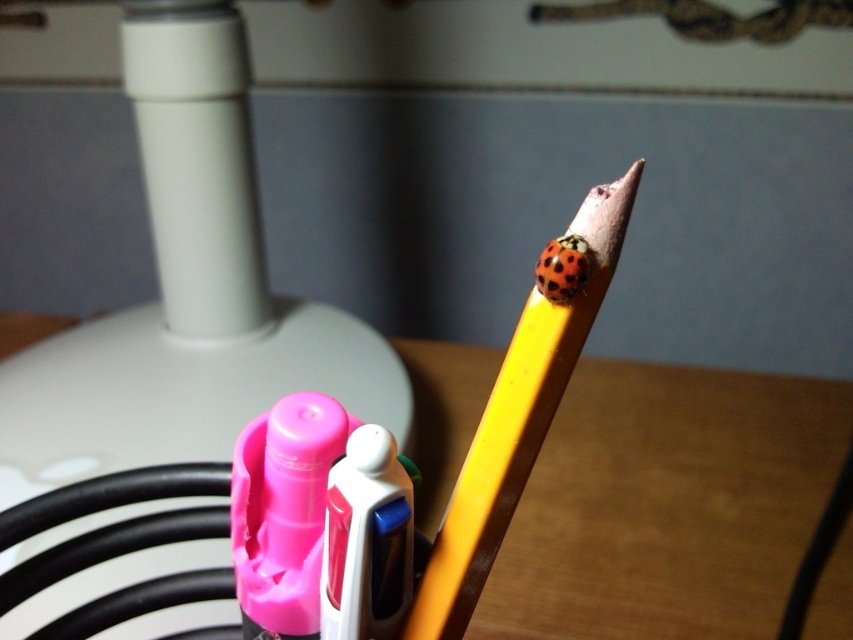
You are trying to place the yellow wood pencil at upper center on the wooden table at center. Based on their sizes, do you think the pencil will fit entirely on the table?

The wooden table at center might be wider than yellow wood pencil at upper center, so there is a possibility that the pencil will fit entirely on the table.

You are organizing a desk and need to place a ruler between the wooden table at center and the yellow wood pencil at upper center. The ruler is 60 centimeters long. Will it fit comfortably between them?

The wooden table at center and yellow wood pencil at upper center are 68.59 centimeters apart. Since the ruler is only 60 centimeters long, there will be enough space to place it comfortably between them with about 8.59 centimeters of extra space.

You are trying to place a small toy on the wooden table at center. Given that the table is at point 0.787, 0.784, can you confirm if this location is suitable for placing the toy?

The wooden table at center is located at point (668, 502), so placing the toy there should be suitable as long as the coordinates align with the table surface.